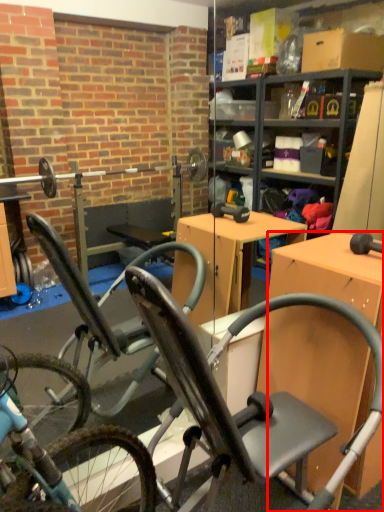
Question: Observing the image, what is the correct spatial positioning of desk (annotated by the red box) in reference to chair?

Choices:
 (A) right
 (B) left

Answer: (A)